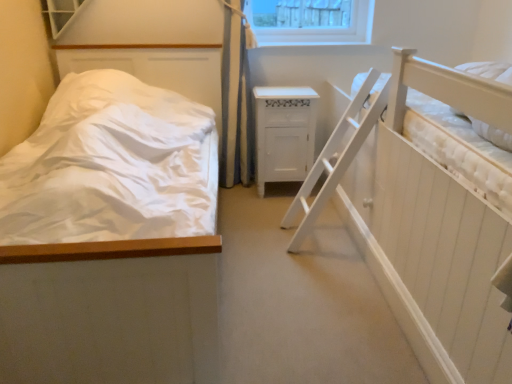
Question: Could you tell me if white textured window at upper left is facing white matte bed at left?

Choices:
 (A) yes
 (B) no

Answer: (B)

Question: Is white textured window at upper left smaller than white matte bed at left?

Choices:
 (A) no
 (B) yes

Answer: (B)

Question: Is white textured window at upper left at the right side of white matte bed at left?

Choices:
 (A) yes
 (B) no

Answer: (B)

Question: Can you confirm if white textured window at upper left is bigger than white matte bed at left?

Choices:
 (A) yes
 (B) no

Answer: (B)

Question: Is white matte bed at left surrounded by white textured window at upper left?

Choices:
 (A) no
 (B) yes

Answer: (A)

Question: From a real-world perspective, relative to white wood cabinet at center, is white matte bed at left vertically above or below?

Choices:
 (A) below
 (B) above

Answer: (B)

Question: Do you think white matte bed at left is within white wood cabinet at center, or outside of it?

Choices:
 (A) outside
 (B) inside

Answer: (A)

Question: From the image's perspective, is white matte bed at left located above or below white wood cabinet at center?

Choices:
 (A) above
 (B) below

Answer: (B)

Question: Is white matte bed at left in front of or behind white wood cabinet at center in the image?

Choices:
 (A) behind
 (B) front

Answer: (B)

Question: In terms of height, does white wooden hospital bed at right look taller or shorter compared to white textured window at upper left?

Choices:
 (A) tall
 (B) short

Answer: (A)

Question: From a real-world perspective, relative to white textured window at upper left, is white wooden hospital bed at right vertically above or below?

Choices:
 (A) above
 (B) below

Answer: (B)

Question: Is white wooden hospital bed at right inside the boundaries of white textured window at upper left, or outside?

Choices:
 (A) outside
 (B) inside

Answer: (A)

Question: Relative to white textured window at upper left, is white wooden hospital bed at right in front or behind?

Choices:
 (A) behind
 (B) front

Answer: (B)

Question: Is white wood cabinet at center wider or thinner than white wooden hospital bed at right?

Choices:
 (A) wide
 (B) thin

Answer: (B)

Question: In terms of size, does white wood cabinet at center appear bigger or smaller than white wooden hospital bed at right?

Choices:
 (A) big
 (B) small

Answer: (B)